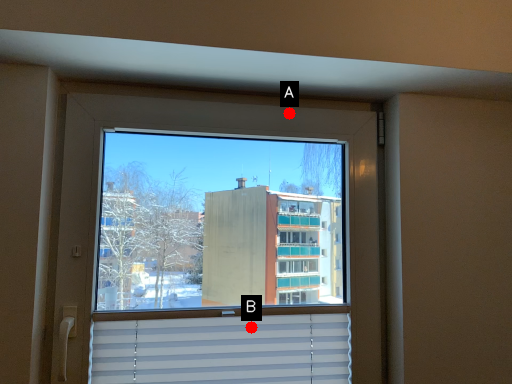
Question: Two points are circled on the image, labeled by A and B beside each circle. Which point appears farthest from the camera in this image?

Choices:
 (A) A is further
 (B) B is further

Answer: (A)